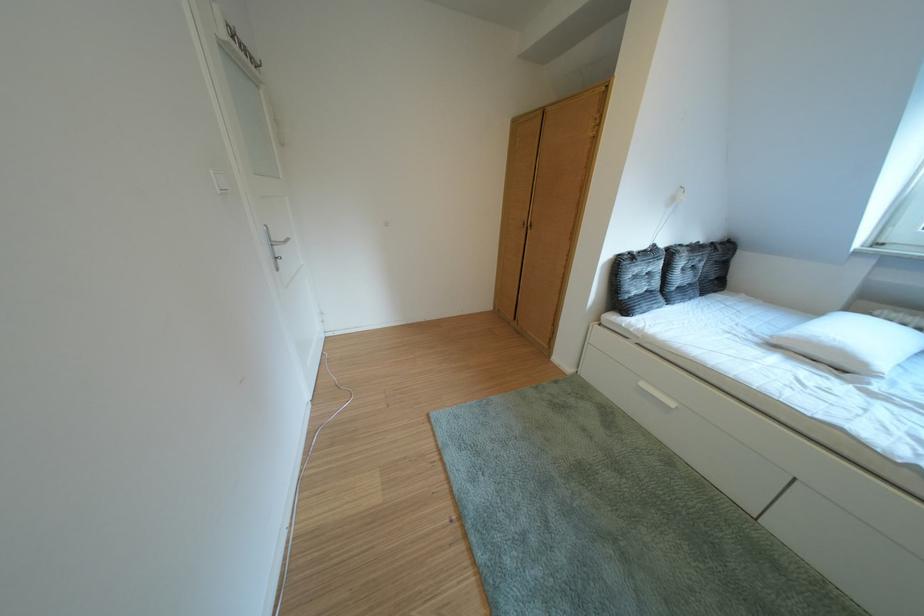
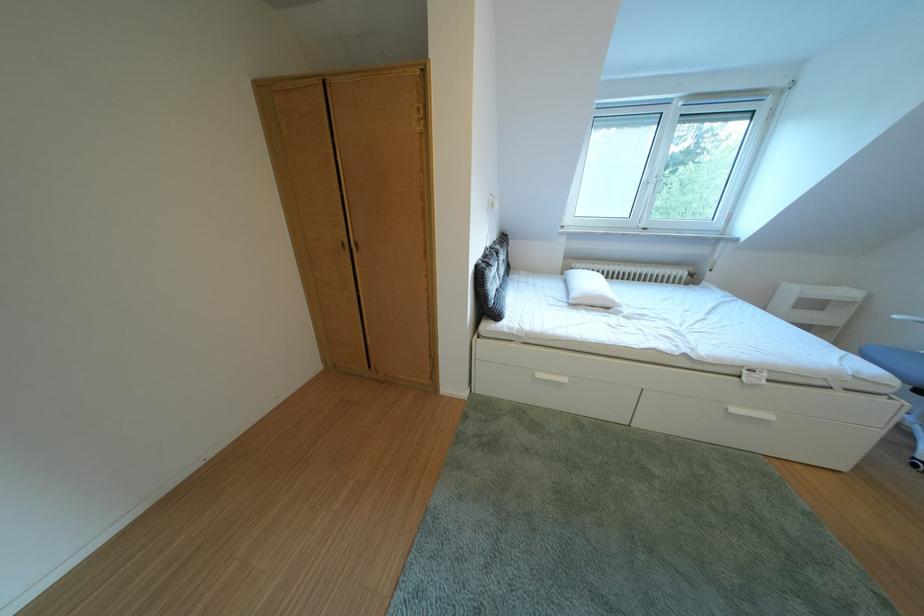
Find the pixel in the second image that matches point 892,318 in the first image.

(588, 270)